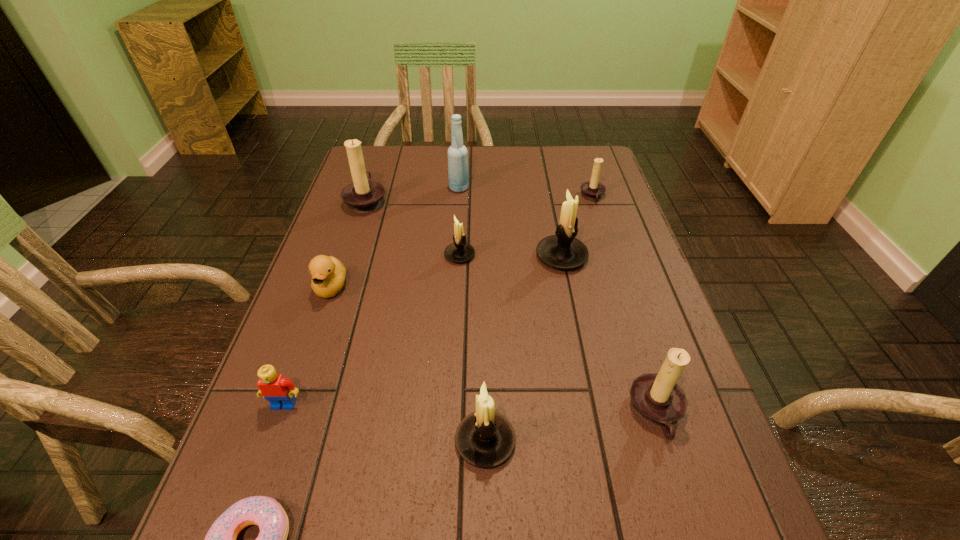
Find the location of a particular element. The height and width of the screenshot is (540, 960). vacant space at the left edge is located at coordinates (339, 245).

At what (x,y) coordinates should I click in order to perform the action: click on vacant area at the right edge of the desktop. Please return your answer as a coordinate pair (x, y). This screenshot has width=960, height=540. Looking at the image, I should click on (625, 209).

I want to click on free space at the far right corner of the desktop, so click(x=581, y=148).

This screenshot has width=960, height=540. I want to click on empty location between the smallest white candle holder and the red Lego, so click(x=372, y=329).

Locate an element on the screen. free space between the red Lego and the smallest white candle holder is located at coordinates (372, 329).

Where is `free space between the bottle and the nearest brown candle holder`? The width and height of the screenshot is (960, 540). free space between the bottle and the nearest brown candle holder is located at coordinates (558, 300).

Identify the location of free point between the second biggest brown candle holder and the duckling. This screenshot has height=540, width=960. (493, 350).

Find the location of `free space that is in between the smallest white candle holder and the biggest brown candle holder`. free space that is in between the smallest white candle holder and the biggest brown candle holder is located at coordinates 413,228.

Find the location of a particular element. This screenshot has width=960, height=540. free area in between the second biggest white candle holder and the smallest white candle holder is located at coordinates (472, 348).

Where is `blank region between the leftmost brown candle holder and the nearest brown candle holder`? The width and height of the screenshot is (960, 540). blank region between the leftmost brown candle holder and the nearest brown candle holder is located at coordinates (512, 306).